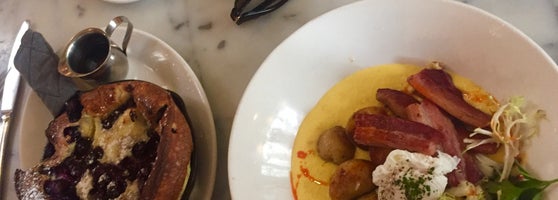
I want to click on silver cup, so click(112, 65).